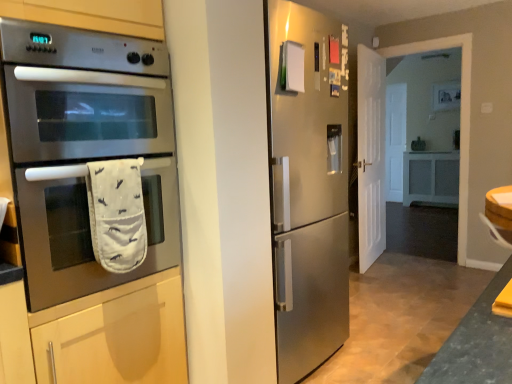
The width and height of the screenshot is (512, 384). In order to click on vacant area situated below white matte door at right (from a real-world perspective) in this screenshot , I will do `click(371, 263)`.